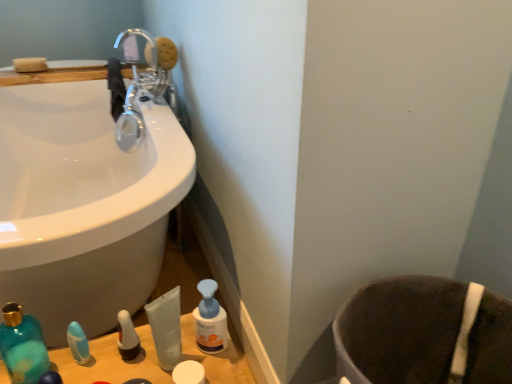
Question: In terms of height, does translucent plastic pump bottle at lower left, positioned as the second toiletry in left-to-right order, look taller or shorter compared to brown fabric toilet bowl at lower right?

Choices:
 (A) tall
 (B) short

Answer: (B)

Question: In the image, is translucent plastic pump bottle at lower left, the third toiletry positioned from the right, on the left side or the right side of brown fabric toilet bowl at lower right?

Choices:
 (A) left
 (B) right

Answer: (A)

Question: Based on their relative distances, which object is farther from the white matte container at lower center, the 1th toiletry in the right-to-left sequence?

Choices:
 (A) translucent plastic pump bottle at lower left, the third toiletry positioned from the right
 (B) brown fabric toilet bowl at lower right
 (C) translucent plastic tube at lower center, the 3th toiletry viewed from the left
 (D) chrome metallic faucet at upper left
 (E) black fabric hand towel at upper left

Answer: (E)

Question: Which is nearer to the blue glossy tube at lower left, positioned as the 1th toiletry in left-to-right order?

Choices:
 (A) white matte container at lower center, the 4th toiletry when ordered from left to right
 (B) teal glass mouthwash at lower left
 (C) chrome metallic faucet at upper left
 (D) translucent plastic pump bottle at lower left, positioned as the second toiletry in left-to-right order
 (E) translucent plastic tube at lower center, which is the second toiletry from right to left

Answer: (B)